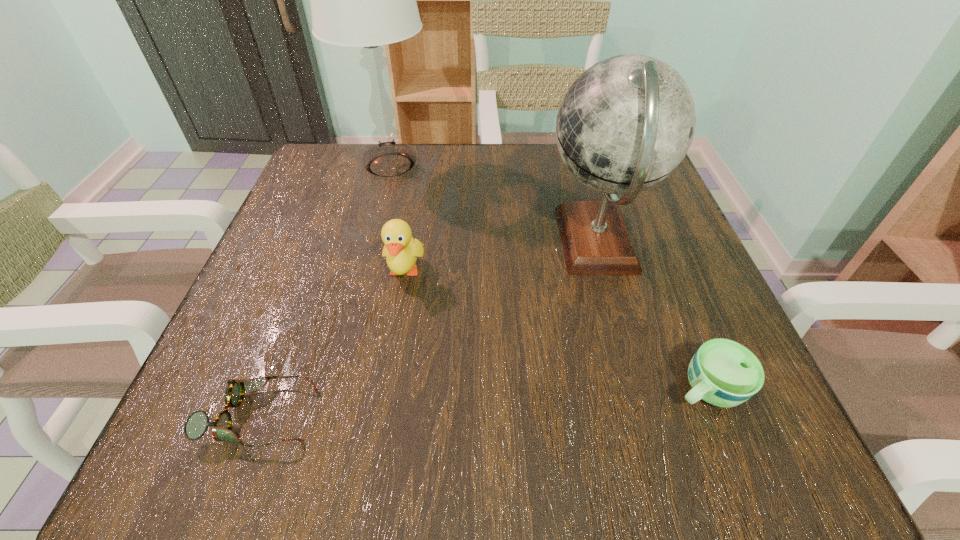
Find the location of a particular element. The height and width of the screenshot is (540, 960). vacant space situated 0.110m on the front-facing side of the duckling is located at coordinates (392, 348).

Locate an element on the screen. Image resolution: width=960 pixels, height=540 pixels. free spot located 0.320m on the left of the second shortest object is located at coordinates (444, 389).

Locate an element on the screen. free point located 0.250m on the front-facing side of the spectacles is located at coordinates (497, 416).

At what (x,y) coordinates should I click in order to perform the action: click on object located in the far edge section of the desktop. Please return your answer as a coordinate pair (x, y). The width and height of the screenshot is (960, 540). Looking at the image, I should click on (365, 0).

The width and height of the screenshot is (960, 540). I want to click on cup that is positioned at the near edge, so point(724,373).

The width and height of the screenshot is (960, 540). Identify the location of spectacles that is positioned at the near edge. (197, 423).

Locate an element on the screen. The image size is (960, 540). table lamp located at the left edge is located at coordinates (365, 0).

Find the location of a particular element. The image size is (960, 540). spectacles located at the left edge is located at coordinates tap(197, 423).

This screenshot has width=960, height=540. What are the coordinates of `globe located in the right edge section of the desktop` in the screenshot? It's located at (626, 123).

At what (x,y) coordinates should I click in order to perform the action: click on cup located in the right edge section of the desktop. Please return your answer as a coordinate pair (x, y). Looking at the image, I should click on (724, 373).